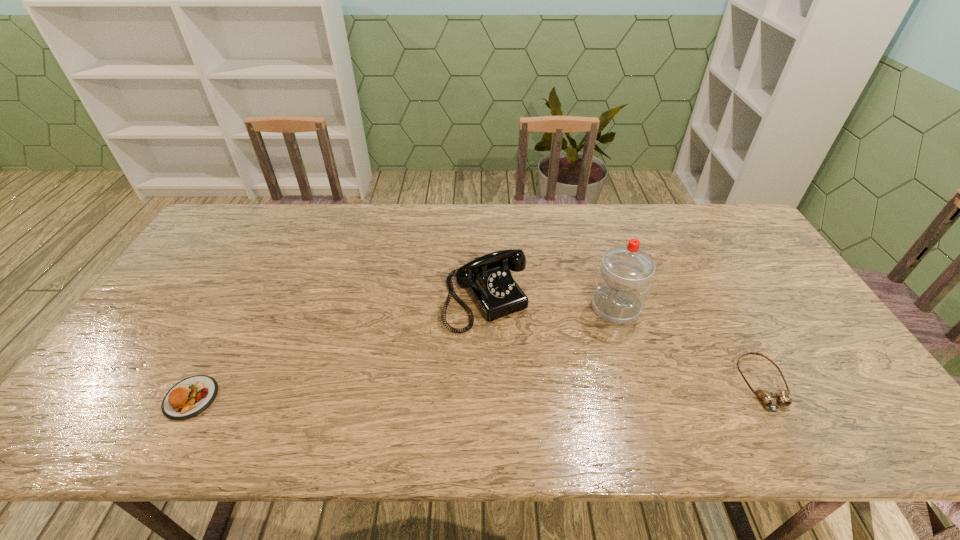
This screenshot has width=960, height=540. Identify the location of free space located on the handle side of the second object from right to left. (568, 362).

The image size is (960, 540). I want to click on vacant space located 0.220m on the handle side of the second object from right to left, so click(x=559, y=372).

Where is `free point located on the dial of the telephone`? This screenshot has width=960, height=540. free point located on the dial of the telephone is located at coordinates pyautogui.click(x=531, y=370).

Locate an element on the screen. Image resolution: width=960 pixels, height=540 pixels. vacant space located 0.130m on the dial of the telephone is located at coordinates (529, 367).

Find the location of a particular element. The height and width of the screenshot is (540, 960). free region located on the dial of the telephone is located at coordinates (514, 345).

Identify the location of patty (food) that is at the near edge. Image resolution: width=960 pixels, height=540 pixels. (191, 396).

The width and height of the screenshot is (960, 540). Find the location of `goggles present at the near edge`. goggles present at the near edge is located at coordinates (767, 397).

In order to click on vacant space at the far edge of the desktop in this screenshot , I will do `click(522, 208)`.

This screenshot has height=540, width=960. I want to click on vacant space at the near edge of the desktop, so click(504, 381).

Identify the location of free space at the left edge of the desktop. (215, 284).